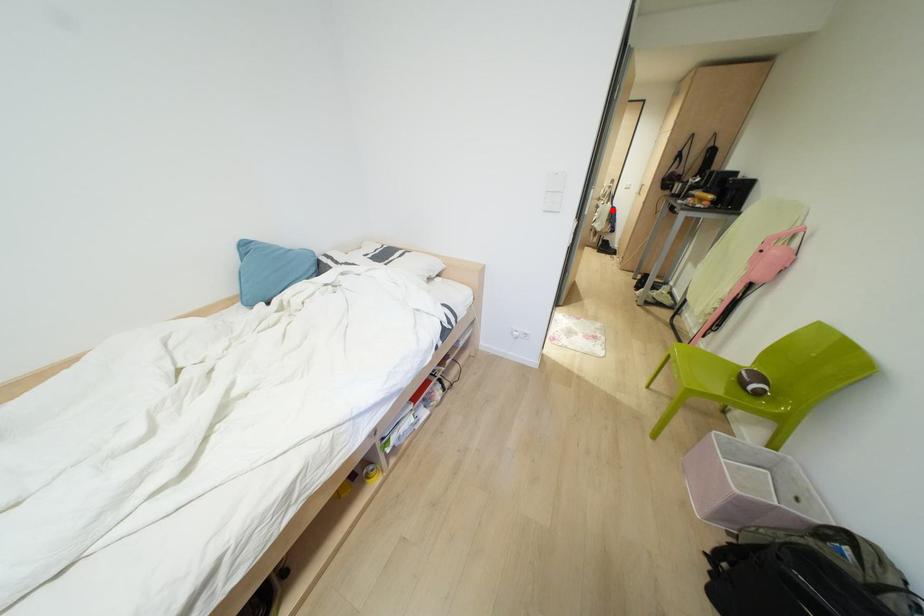
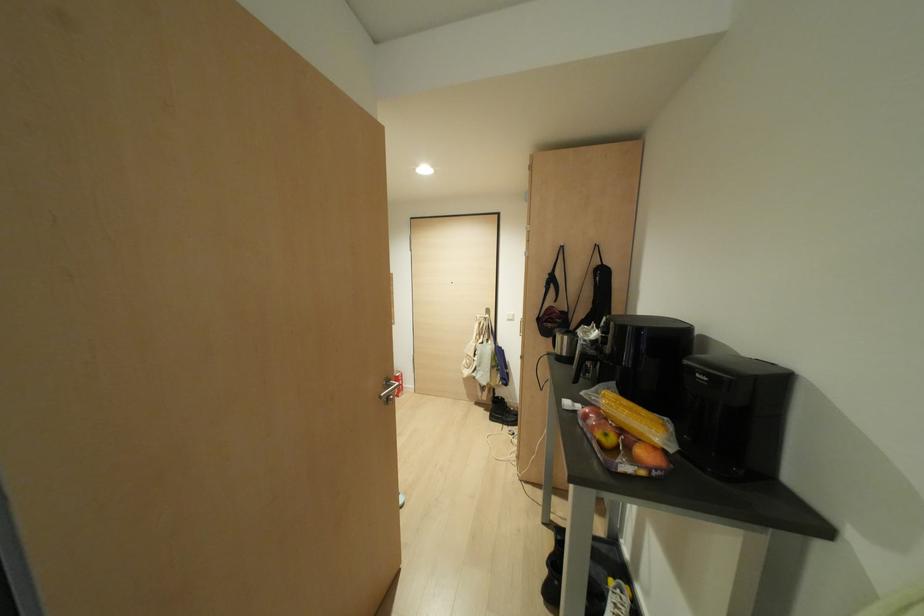
Locate, in the second image, the point that corresponds to the highlighted location in the first image.

(497, 352)